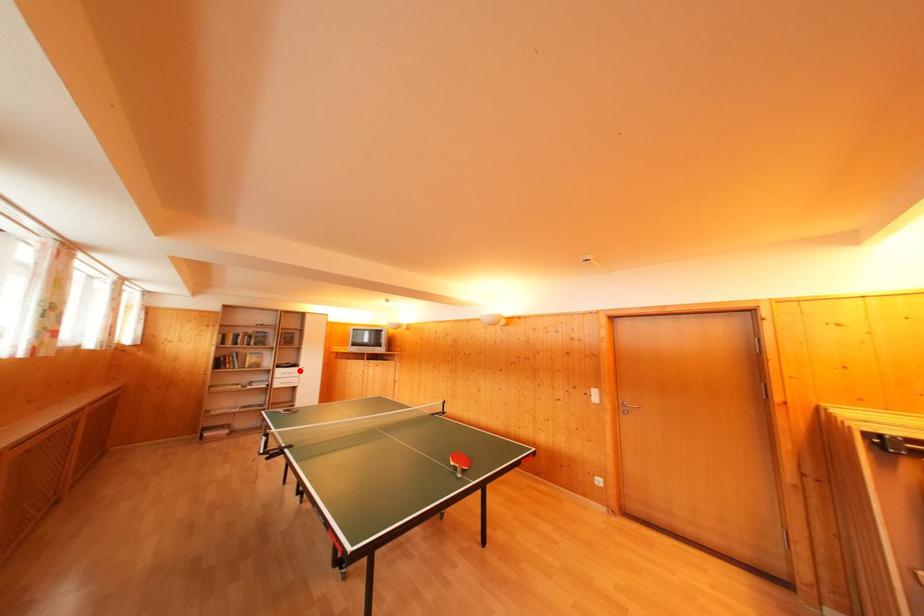
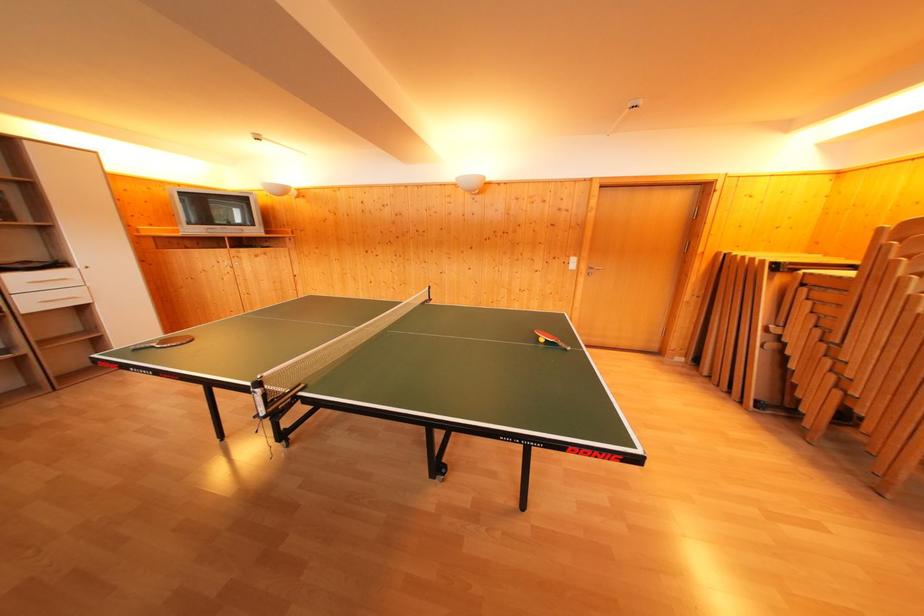
Locate, in the second image, the point that corresponds to the highlighted location in the first image.

(64, 270)